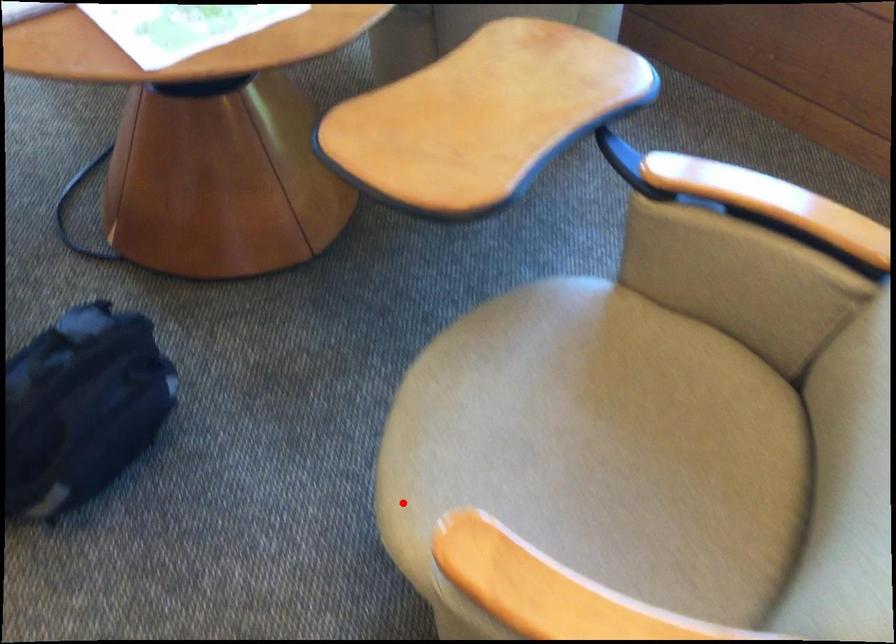
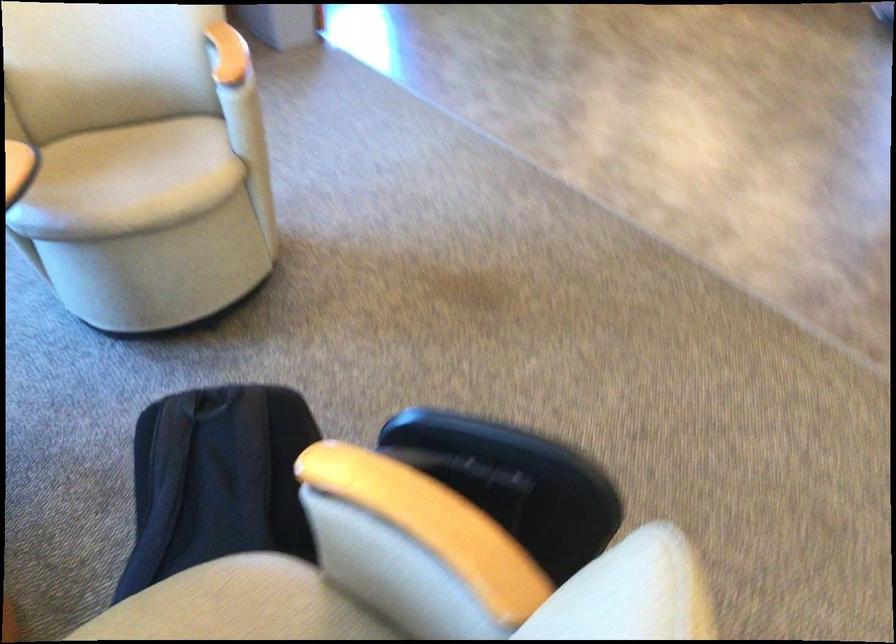
The point at the highlighted location is marked in the first image. Where is the corresponding point in the second image?

(127, 180)